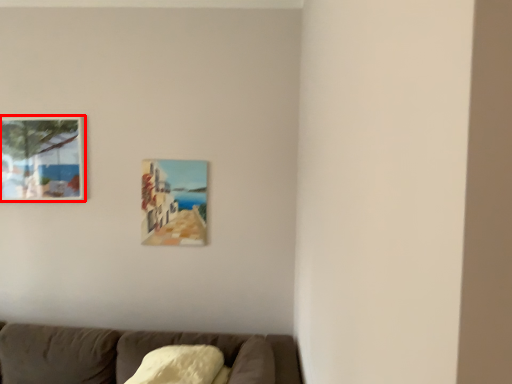
Question: Where is picture frame (annotated by the red box) located in relation to picture frame in the image?

Choices:
 (A) left
 (B) right

Answer: (A)